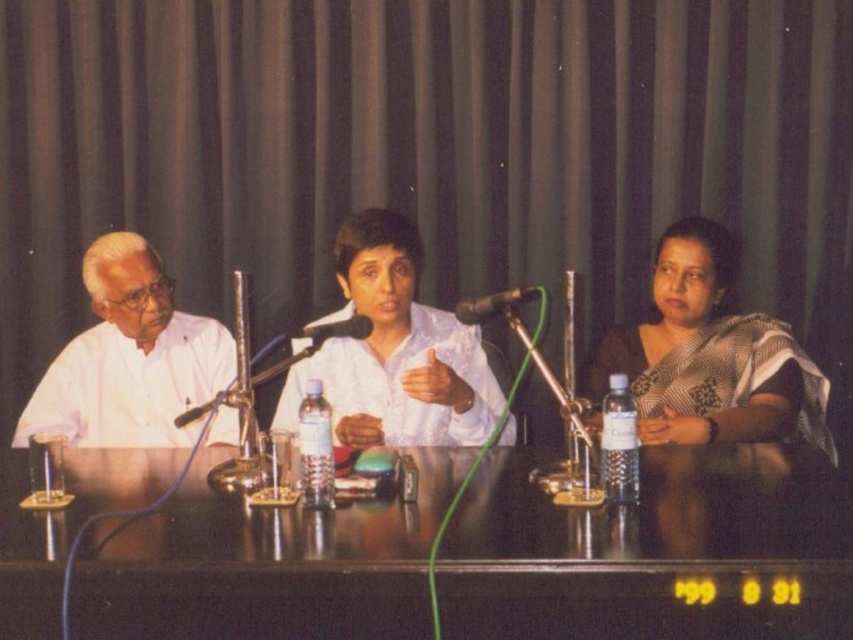
You are organizing a photoshoot and need to place two white shirts on a table. The white glossy shirt at center and the white matte shirt at left must be arranged so that the wider one is on the left side. Which shirt should you place on the left?

The white matte shirt at left is wider than the white glossy shirt at center, so you should place the white matte shirt at left on the left side.

You are organizing a conference and need to ensure that the matte black curtain at upper center is visible to all attendees. Since the black glossy table at center is in front of it, will the curtain still be visible from the audience seats?

The matte black curtain at upper center is above the black glossy table at center, so it should still be visible from the audience seats as it is positioned higher than the table.

You are an event organizer who needs to hang a banner between the matte black curtain at upper center and the black glossy table at center. Since the banner must be as long as the taller object, which object determines the banner length?

The matte black curtain at upper center is taller than the black glossy table at center, so the banner length should match the height of the matte black curtain at upper center.